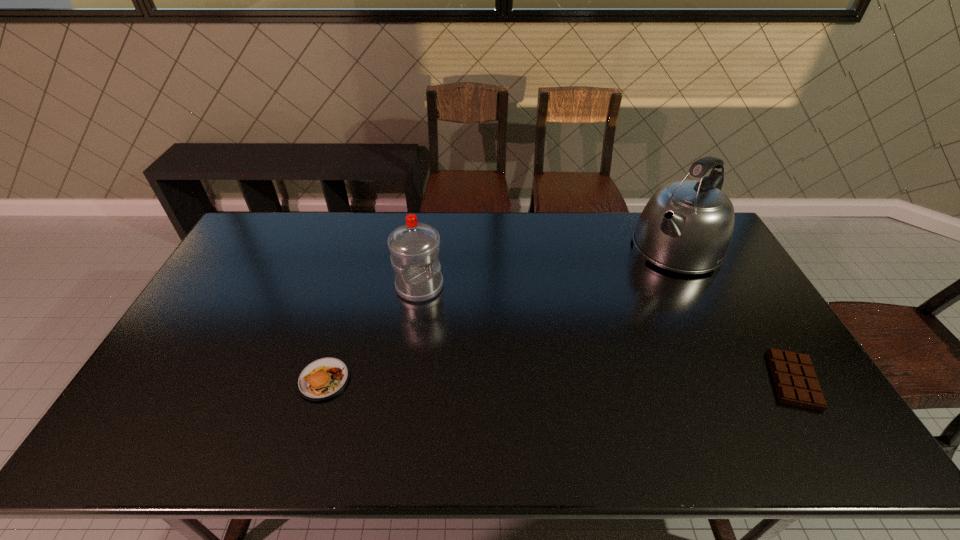
This screenshot has width=960, height=540. In order to click on the third tallest object in this screenshot , I will do `click(324, 378)`.

Locate an element on the screen. patty is located at coordinates (324, 378).

Identify the location of the shortest object. (795, 380).

At what (x,y) coordinates should I click in order to perform the action: click on the tallest object. Please return your answer as a coordinate pair (x, y). Looking at the image, I should click on point(687,226).

Locate an element on the screen. The image size is (960, 540). the second tallest object is located at coordinates (414, 247).

Locate an element on the screen. water bottle is located at coordinates (414, 247).

Locate an element on the screen. This screenshot has height=540, width=960. vacant space located 0.090m on the left of the patty is located at coordinates (264, 380).

Identify the location of free point located 0.280m on the back of the candy bar. (734, 283).

I want to click on free space located 0.070m on the spout of the kettle, so click(x=645, y=279).

Identify the location of free region located on the spout of the kettle. (640, 284).